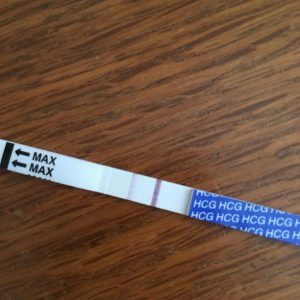
Identify the location of dark streaks in wood desk. The height and width of the screenshot is (300, 300). (193, 244), (89, 241), (170, 52), (222, 60), (247, 108), (287, 147).